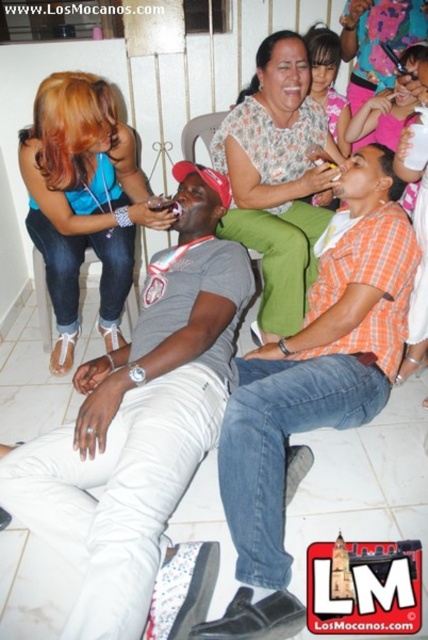
Question: Does orange plaid shirt at center have a larger size compared to floral fabric blouse at center?

Choices:
 (A) yes
 (B) no

Answer: (A)

Question: Is white matte shirt at center thinner than smooth skin face at upper center?

Choices:
 (A) yes
 (B) no

Answer: (B)

Question: Does matte blue tank top at upper left appear under smooth skin face at upper center?

Choices:
 (A) yes
 (B) no

Answer: (A)

Question: Estimate the real-world distances between objects in this image. Which object is closer to the matte blue tank top at upper left?

Choices:
 (A) white matte shirt at center
 (B) smooth skin face at upper center
 (C) floral fabric blouse at center

Answer: (A)

Question: Which object is farther from the camera taking this photo?

Choices:
 (A) white matte shirt at center
 (B) floral fabric blouse at center
 (C) matte blue tank top at upper left

Answer: (B)

Question: Among these points, which one is nearest to the camera?

Choices:
 (A) (276, 333)
 (B) (62, 208)
 (C) (372, 195)

Answer: (C)